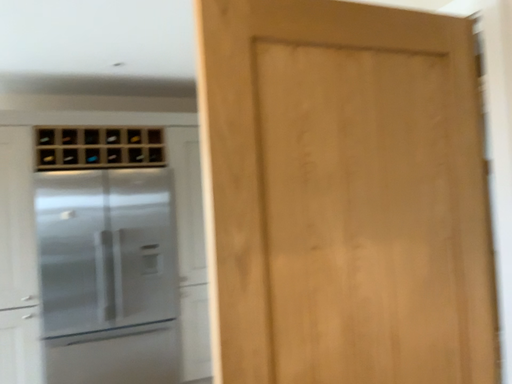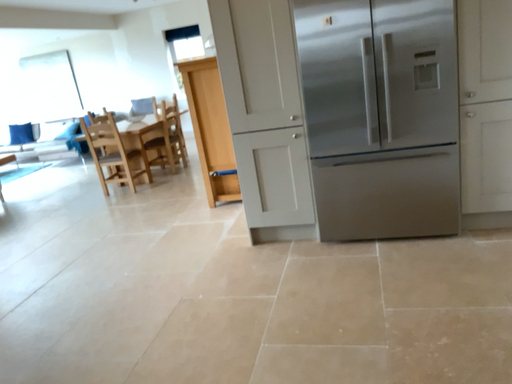
Question: How did the camera likely rotate when shooting the video?

Choices:
 (A) rotated right
 (B) rotated left

Answer: (B)